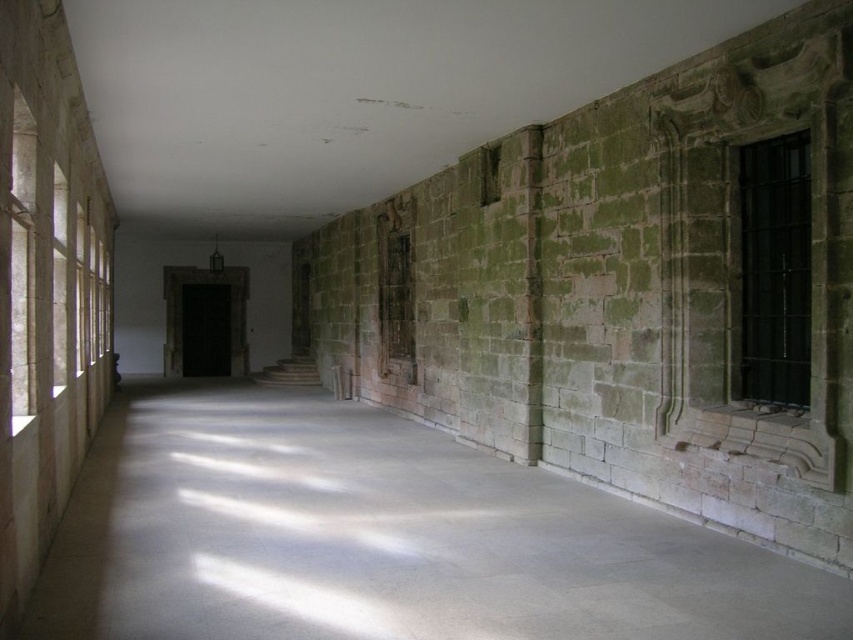
You are standing in the corridor of an old stone building. You see two points marked on the floor. The first point is at coordinate point (155, 509) and the second point is at coordinate point (747, 349). If you are facing the direction of the corridor, which point is located behind the other?

Point (155, 509) is behind point (747, 349).

You are a delivery person carrying a large box that is 2 meters wide. You are in the corridor and see the smooth concrete floor at center and the black metal window at right. Can you move the box through the corridor without hitting the walls?

The smooth concrete floor at center is wider than the black metal window at right, so the corridor is at least as wide as the floor. Since the box is 2 meters wide, if the corridor is wider than 2 meters, it can pass. However, the exact width isn